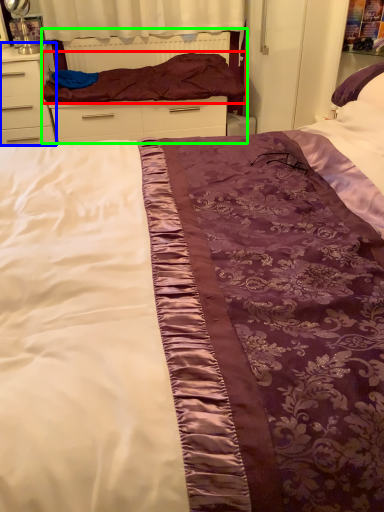
Question: Based on their relative distances, which object is farther from blanket (highlighted by a red box)? Choose from chest of drawers (highlighted by a blue box) and bed frame (highlighted by a green box).

Choices:
 (A) chest of drawers
 (B) bed frame

Answer: (A)